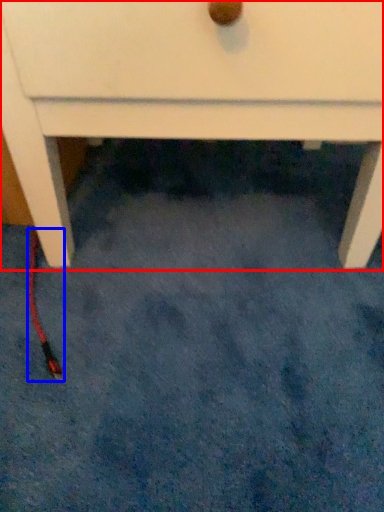
Question: Which object is closer to the camera taking this photo, chest of drawers (highlighted by a red box) or cable (highlighted by a blue box)?

Choices:
 (A) chest of drawers
 (B) cable

Answer: (A)